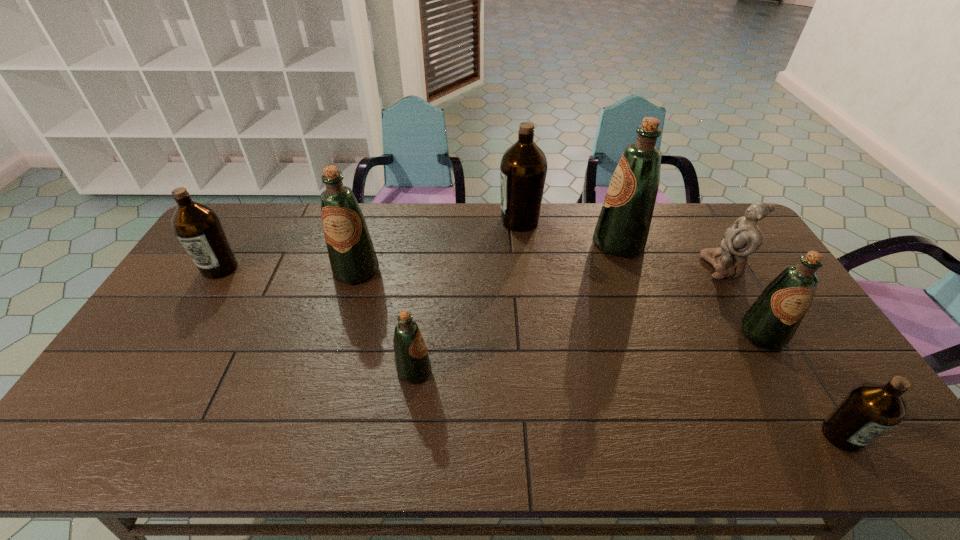
You are a GUI agent. You are given a task and a screenshot of the screen. Output one action in this format:
    pyautogui.click(x=<x>, y=<y>)
    Task: Click on the biggest green olive oil
    This screenshot has height=540, width=960.
    Given the screenshot: What is the action you would take?
    pyautogui.click(x=622, y=229)

Find the location of a particular element. the tallest object is located at coordinates (622, 229).

Where is `the farthest brown olive oil`? the farthest brown olive oil is located at coordinates (523, 168).

Image resolution: width=960 pixels, height=540 pixels. What are the coordinates of `the second brown olive oil from right to left` in the screenshot? It's located at (523, 168).

Where is `the sixth olive oil from right to left`? the sixth olive oil from right to left is located at coordinates (353, 260).

The width and height of the screenshot is (960, 540). I want to click on the second object from left to right, so click(353, 260).

Image resolution: width=960 pixels, height=540 pixels. I want to click on the leftmost olive oil, so click(x=197, y=226).

The height and width of the screenshot is (540, 960). I want to click on the leftmost object, so click(x=197, y=226).

Identify the location of the third biggest green olive oil. This screenshot has height=540, width=960. (770, 323).

Identify the location of the second nearest green olive oil. (770, 323).